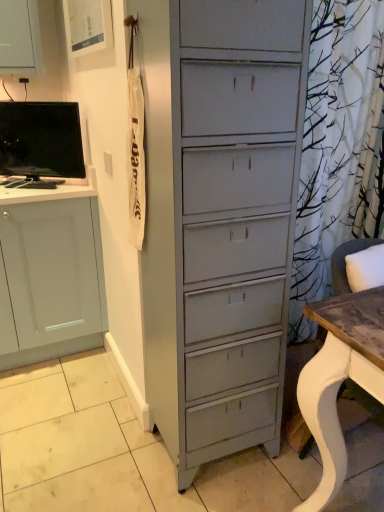
You are a GUI agent. You are given a task and a screenshot of the screen. Output one action in this format:
    pyautogui.click(x=<x>, y=<y>)
    Task: Click on the free location to the left of white wood desk at right
    
    Given the screenshot: What is the action you would take?
    pyautogui.click(x=261, y=481)